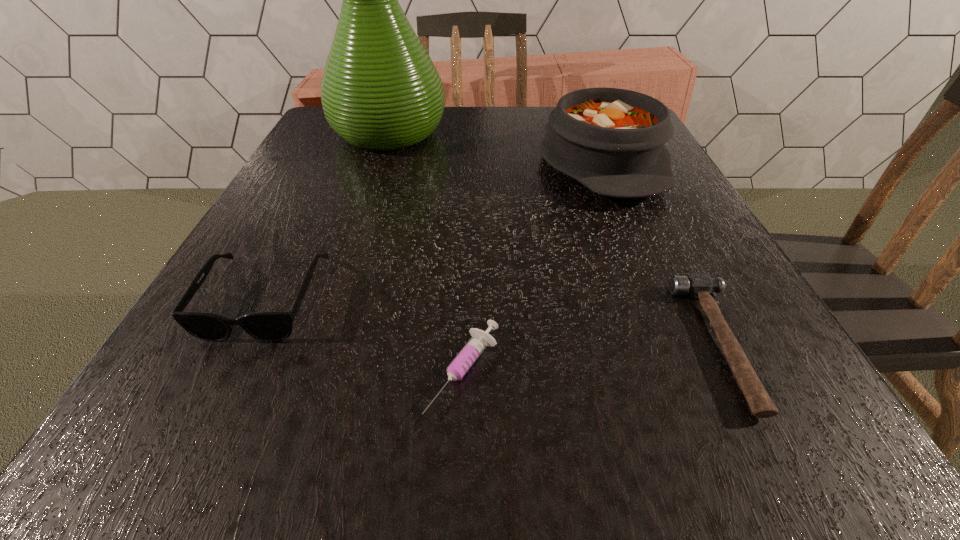
Where is `free space between the hammer and the third object from right to left`? free space between the hammer and the third object from right to left is located at coordinates (592, 357).

The image size is (960, 540). I want to click on vacant area between the casserole and the tallest object, so click(x=495, y=148).

I want to click on blank region between the casserole and the tallest object, so click(495, 148).

Where is `free space that is in between the third tallest object and the casserole`? This screenshot has width=960, height=540. free space that is in between the third tallest object and the casserole is located at coordinates (433, 231).

What are the coordinates of `free space between the syringe and the hammer` in the screenshot? It's located at (592, 357).

The image size is (960, 540). Find the location of `blank region between the casserole and the hammer`. blank region between the casserole and the hammer is located at coordinates (661, 253).

Select which object appears as the fourth closest to the fourth shortest object. Please provide its 2D coordinates. Your answer should be formatted as a tuple, i.e. [(x, y)], where the tuple contains the x and y coordinates of a point satisfying the conditions above.

[(267, 326)]

Identify which object is located as the fourth nearest to the casserole. Please provide its 2D coordinates. Your answer should be formatted as a tuple, i.e. [(x, y)], where the tuple contains the x and y coordinates of a point satisfying the conditions above.

[(267, 326)]

Locate an element on the screen. The image size is (960, 540). vacant position in the image that satisfies the following two spatial constraints: 1. on the front side of the casserole; 2. on the left side of the vase is located at coordinates (379, 163).

Find the location of a particular element. vacant region that satisfies the following two spatial constraints: 1. at the front lenses of the third shortest object; 2. on the left side of the syringe is located at coordinates (229, 370).